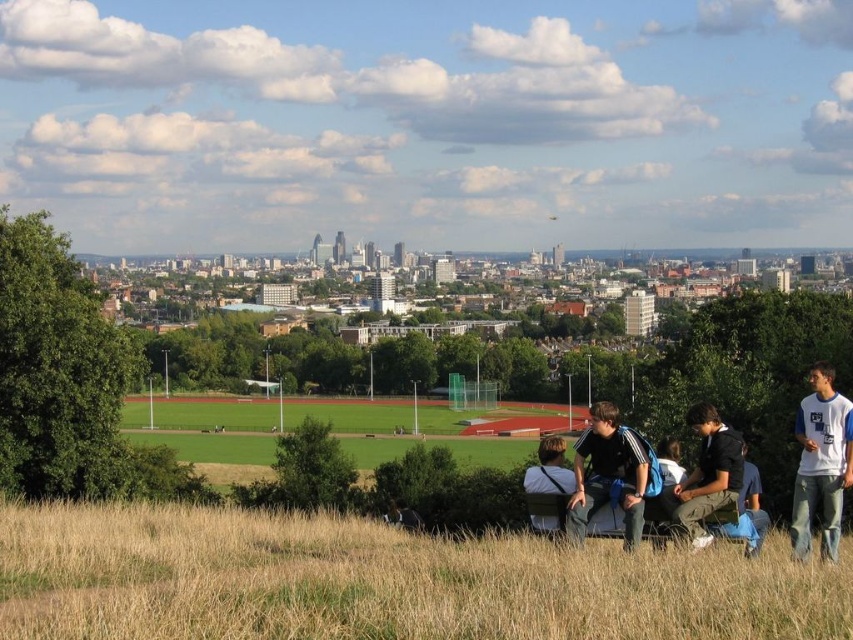
You are standing at the center of the image and want to locate the dark blue jeans at lower right. In which direction should you look to find them?

You should look to the right and downward from the center of the image to locate the dark blue jeans at lower right, as their position is at point 0.725 on the x and 0.964 on the y axis.

You are standing at the top of a hill overlooking the urban landscape. You notice the dry grass at lower center and the dark blue jeans at lower right. Which object is wider in the image?

The dry grass at lower center is wider than the dark blue jeans at lower right according to the description provided.